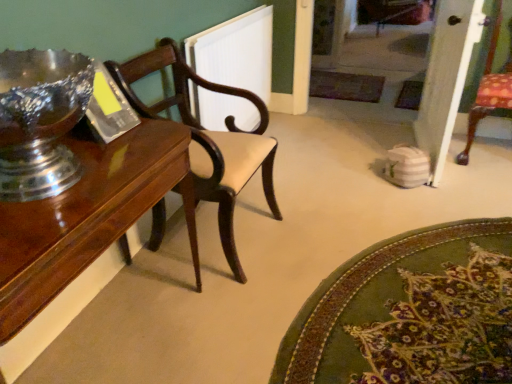
Question: From the image's perspective, does white textured radiator at upper center appear higher than green textured rug at lower right?

Choices:
 (A) yes
 (B) no

Answer: (A)

Question: Considering the relative positions of white textured radiator at upper center and green textured rug at lower right in the image provided, is white textured radiator at upper center behind green textured rug at lower right?

Choices:
 (A) yes
 (B) no

Answer: (A)

Question: Is white textured radiator at upper center outside green textured rug at lower right?

Choices:
 (A) no
 (B) yes

Answer: (B)

Question: Is white textured radiator at upper center taller than green textured rug at lower right?

Choices:
 (A) yes
 (B) no

Answer: (A)

Question: Would you say green textured rug at lower right is part of white textured radiator at upper center's contents?

Choices:
 (A) yes
 (B) no

Answer: (B)

Question: Is point tap(151, 195) positioned closer to the camera than point tap(113, 61)?

Choices:
 (A) closer
 (B) farther

Answer: (A)

Question: Choose the correct answer: Is shiny wood table at left inside mahogany wood chair at left or outside it?

Choices:
 (A) inside
 (B) outside

Answer: (B)

Question: In the image, is shiny wood table at left positioned in front of or behind mahogany wood chair at left?

Choices:
 (A) behind
 (B) front

Answer: (B)

Question: From the image's perspective, is shiny wood table at left located above or below mahogany wood chair at left?

Choices:
 (A) above
 (B) below

Answer: (B)

Question: From a real-world perspective, is white textured radiator at upper center physically located above or below mahogany wood chair at left?

Choices:
 (A) above
 (B) below

Answer: (B)

Question: Which is correct: white textured radiator at upper center is inside mahogany wood chair at left, or outside of it?

Choices:
 (A) outside
 (B) inside

Answer: (A)

Question: Is white textured radiator at upper center in front of or behind mahogany wood chair at left in the image?

Choices:
 (A) behind
 (B) front

Answer: (A)

Question: Visually, is white textured radiator at upper center positioned to the left or to the right of mahogany wood chair at left?

Choices:
 (A) left
 (B) right

Answer: (B)

Question: From their relative heights in the image, would you say green textured rug at lower right is taller or shorter than shiny wood table at left?

Choices:
 (A) short
 (B) tall

Answer: (A)

Question: In terms of width, does green textured rug at lower right look wider or thinner when compared to shiny wood table at left?

Choices:
 (A) wide
 (B) thin

Answer: (A)